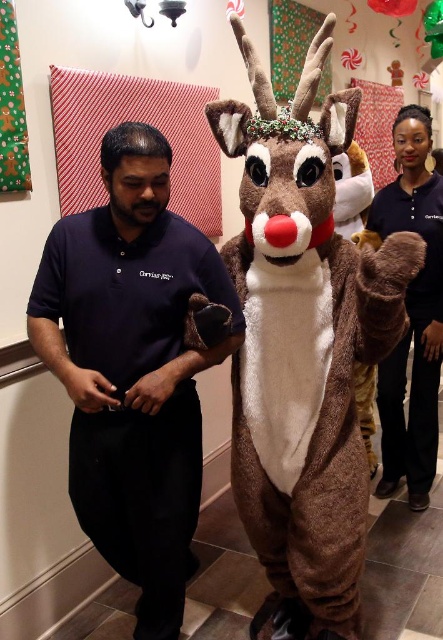
Question: Is fuzzy brown reindeer at center positioned behind dark blue cotton shirt at center?

Choices:
 (A) no
 (B) yes

Answer: (A)

Question: Considering the relative positions of fuzzy brown reindeer at center and brown plush reindeer at center in the image provided, where is fuzzy brown reindeer at center located with respect to brown plush reindeer at center?

Choices:
 (A) below
 (B) above

Answer: (A)

Question: Which point is farther to the camera?

Choices:
 (A) (408, 148)
 (B) (97, 513)

Answer: (A)

Question: Which point appears closest to the camera in this image?

Choices:
 (A) [426, 182]
 (B) [345, 285]
 (C) [133, 264]

Answer: (C)

Question: Does fuzzy brown reindeer at center have a larger size compared to dark blue cotton shirt at center?

Choices:
 (A) yes
 (B) no

Answer: (A)

Question: Which object appears closest to the camera in this image?

Choices:
 (A) dark blue cotton shirt at center
 (B) fuzzy brown reindeer at center

Answer: (B)